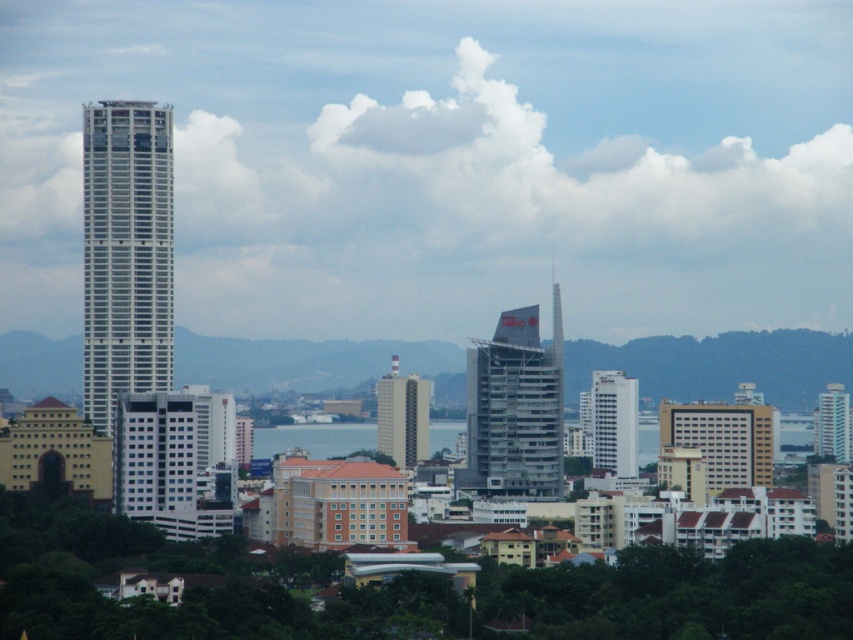
You are an architect evaluating the cityscape. You notice the white glossy building at center and the matte beige building at center. Which building is shorter?

The white glossy building at center is shorter than the matte beige building at center.

You are standing in the city and want to take a photo of both the matte beige building at center and the white glass building at right. Which building should you position yourself to the left of to capture both in your shot?

You should position yourself to the left of the matte beige building at center because it is located to the left of the white glass building at right, allowing both to be captured in the frame.

You are standing in the city and see the metallic glass skyscraper at center and the white glossy building at center. Which one is positioned higher in the image?

The metallic glass skyscraper at center is located above the white glossy building at center, so it is positioned higher in the image.